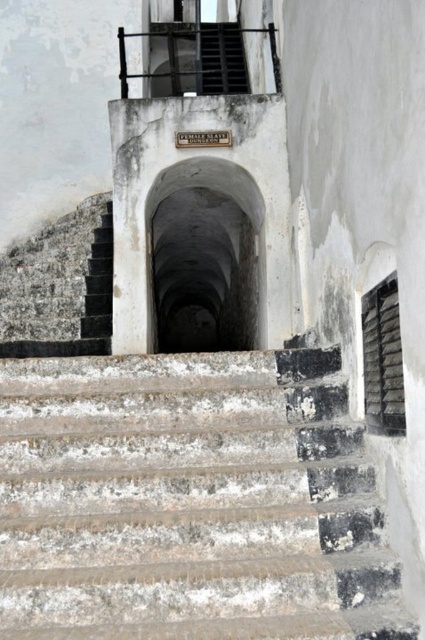
You are a tour guide leading a group through this historic site. You need to ensure visitors can safely walk down the worn concrete stairs at center while holding onto the black metal balustrade at upper center. Based on their sizes, is the balustrade wide enough to provide a secure grip for visitors?

The worn concrete stairs at center are wider than the black metal balustrade at upper center. Since the balustrade is narrower than the stairs, it may not provide sufficient width for all visitors to grip securely, so additional safety measures might be needed.

You are a tour guide explaining the historic structure to visitors. You point out the rusty metal stairs at center and the black metal balustrade at upper center. Which of these two objects is positioned to the right of the other?

The rusty metal stairs at center are to the right of the black metal balustrade at upper center.